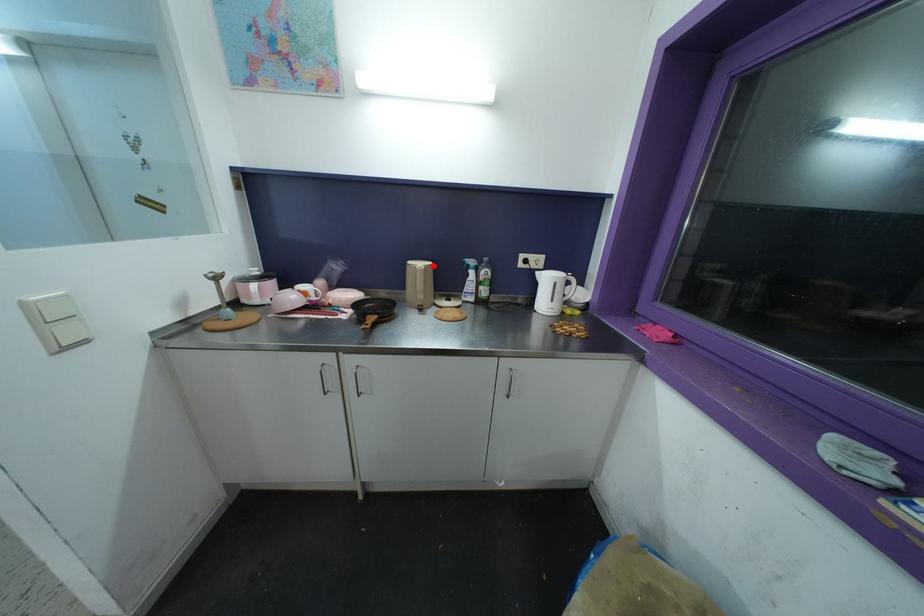
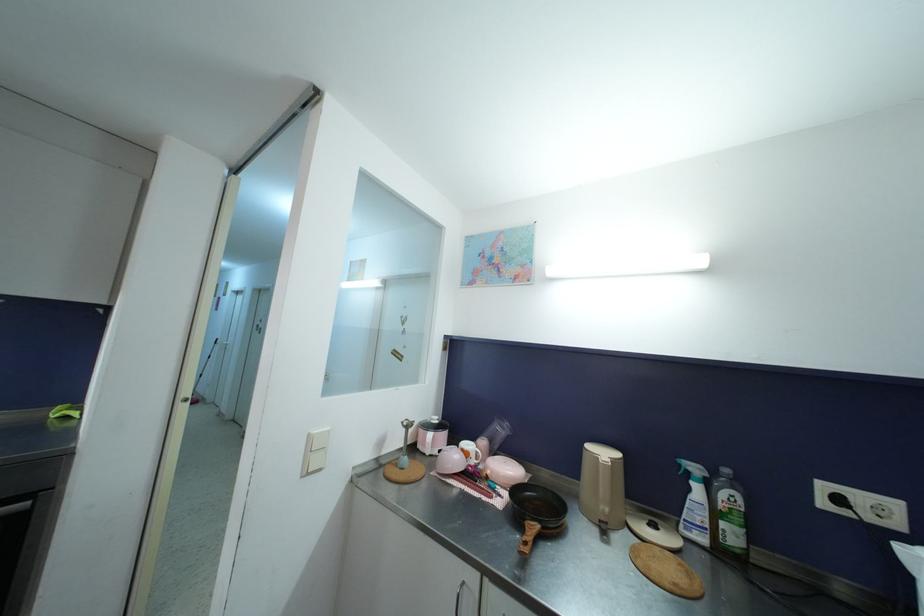
Locate, in the second image, the point that corresponds to the highlighted location in the first image.

(623, 458)